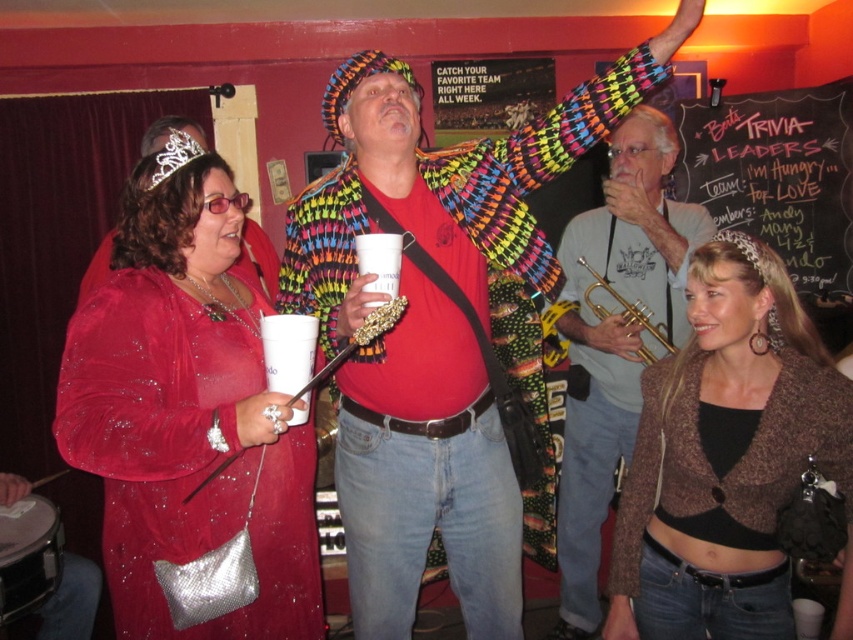
You are at the party and want to take a photo of the matte gray shirt at center and the brushed metal drum at lower left. Which object should you focus on first if you want to capture both in the frame without moving the camera?

The matte gray shirt at center has a larger size compared to the brushed metal drum at lower left, so you should focus on the matte gray shirt at center first to ensure it fits properly in the frame.

You are at a party and want to grab the gold shiny trumpet at center to play a song. However, there is a brushed metal drum at lower left in the way. Can you reach the trumpet without moving the drum?

The brushed metal drum at lower left is located below the gold shiny trumpet at center, so you can reach the trumpet without moving the drum as it is positioned above it.